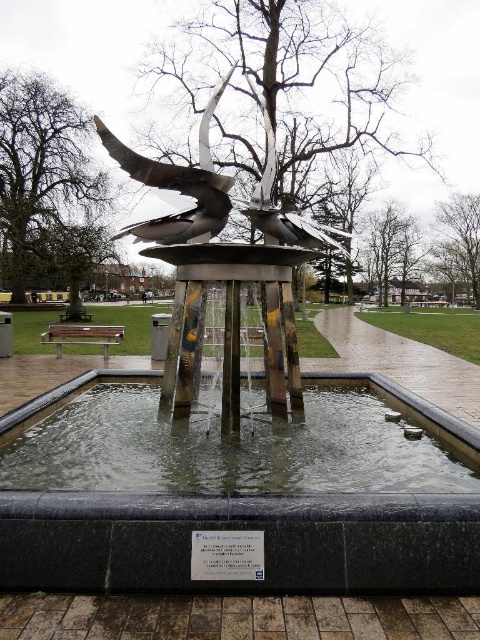
Can you confirm if clear glass water at center is positioned above polished silver bird at center?

No, clear glass water at center is not above polished silver bird at center.

Which is above, clear glass water at center or polished silver bird at center?

Positioned higher is polished silver bird at center.

Between point (285, 428) and point (203, 134), which one is positioned in front?

Point (285, 428)

This screenshot has height=640, width=480. Identify the location of clear glass water at center. (228, 445).

Between clear glass water at center and metallic silver bird at upper center, which one has less height?

clear glass water at center is shorter.

Between clear glass water at center and metallic silver bird at upper center, which one appears on the right side from the viewer's perspective?

A: From the viewer's perspective, metallic silver bird at upper center appears more on the right side.

Which is behind, point (148, 420) or point (254, 97)?

The point (254, 97) is more distant.

Locate an element on the screen. This screenshot has width=480, height=640. clear glass water at center is located at coordinates coord(228,445).

What do you see at coordinates (284, 204) in the screenshot? The image size is (480, 640). I see `metallic silver bird at upper center` at bounding box center [284, 204].

Where is `metallic silver bird at upper center`? metallic silver bird at upper center is located at coordinates (284, 204).